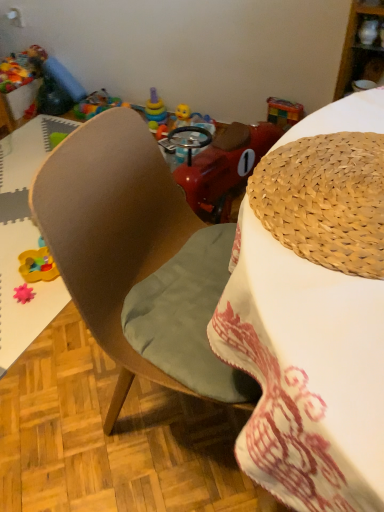
This screenshot has height=512, width=384. What are the coordinates of `free spot above woven straw hat at upper right (from a real-world perspective)` in the screenshot? It's located at (327, 197).